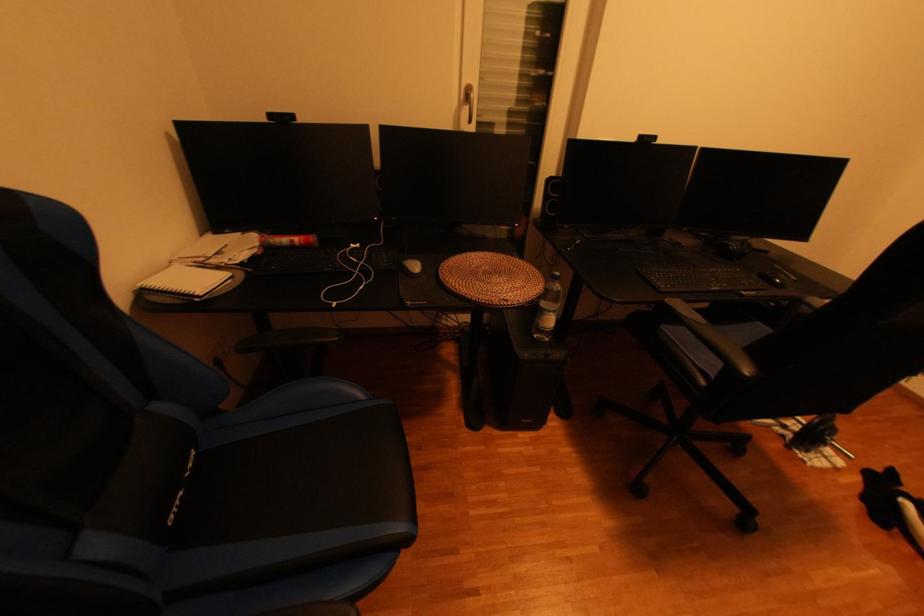
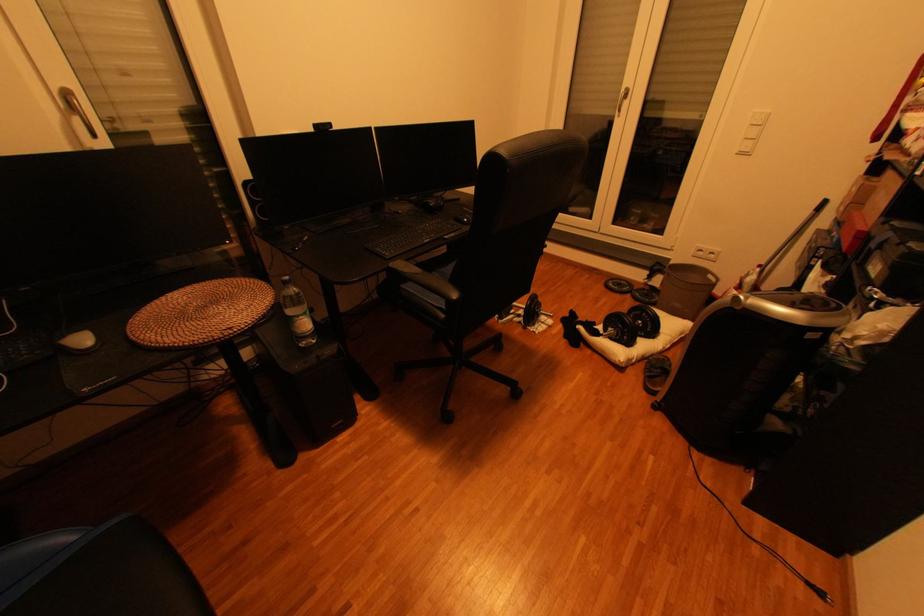
Where in the second image is the point corresponding to point (677, 302) from the first image?

(400, 265)